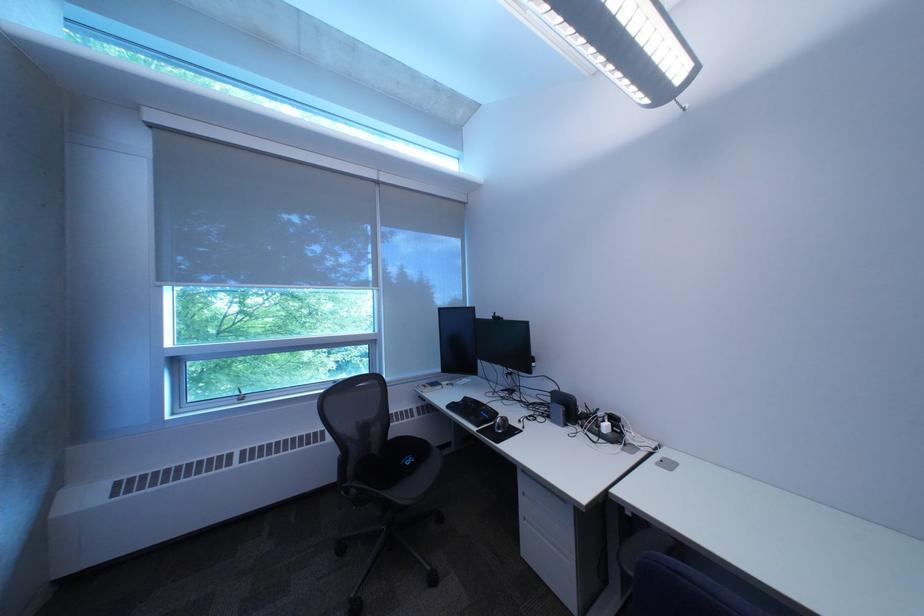
This screenshot has height=616, width=924. Identify the location of black chair armrest. (383, 464).